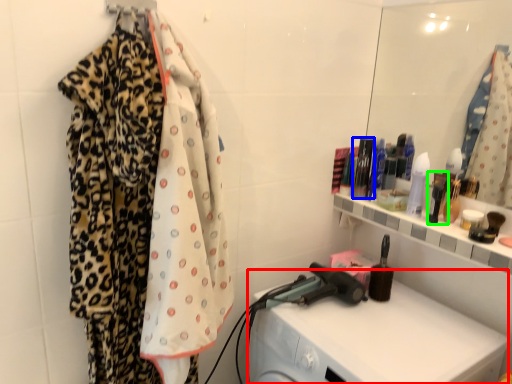
Question: Which object is the closest to the washing machine (highlighted by a red box)? Choose among these: toiletry (highlighted by a blue box) or toiletry (highlighted by a green box).

Choices:
 (A) toiletry
 (B) toiletry

Answer: (B)